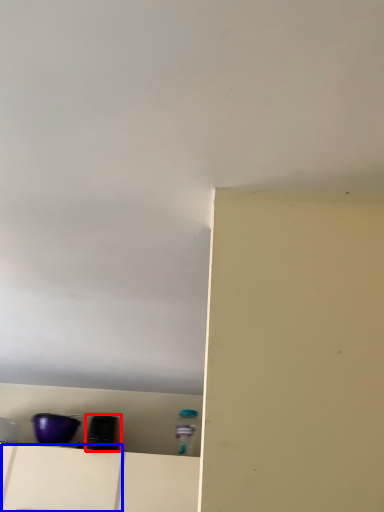
Question: Which object appears closest to the camera in this image, appliance (highlighted by a red box) or drawer (highlighted by a blue box)?

Choices:
 (A) appliance
 (B) drawer

Answer: (B)